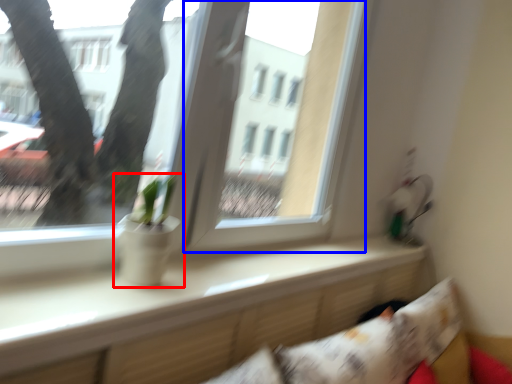
Question: Which object appears farthest to the camera in this image, houseplant (highlighted by a red box) or window screen (highlighted by a blue box)?

Choices:
 (A) houseplant
 (B) window screen

Answer: (B)